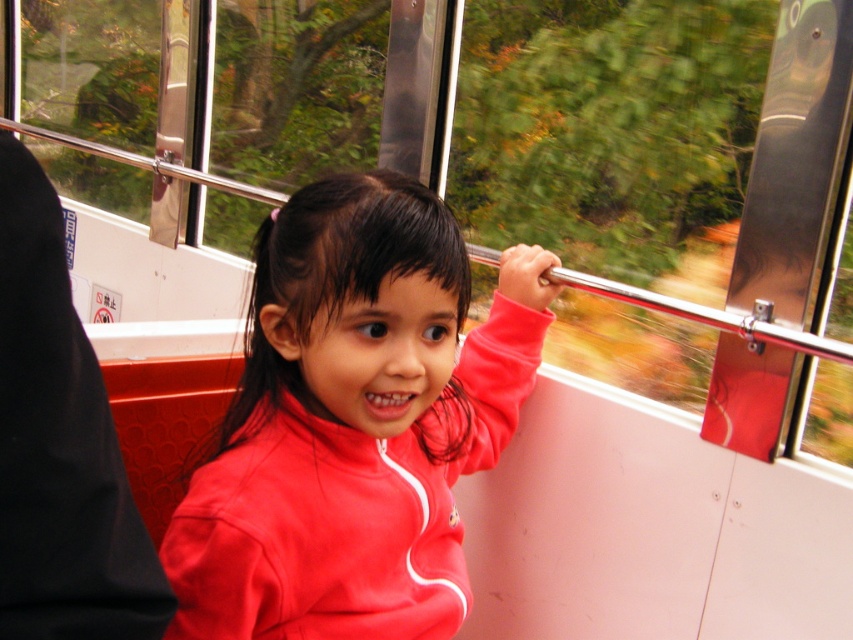
Question: Can you confirm if matte red jacket at center is positioned to the left of black fabric coach at left?

Choices:
 (A) no
 (B) yes

Answer: (A)

Question: Which point appears closest to the camera in this image?

Choices:
 (A) (395, 243)
 (B) (33, 600)

Answer: (B)

Question: Is matte red jacket at center wider than black fabric coach at left?

Choices:
 (A) yes
 (B) no

Answer: (A)

Question: Can you confirm if matte red jacket at center is positioned below black fabric coach at left?

Choices:
 (A) no
 (B) yes

Answer: (B)

Question: Which point appears closest to the camera in this image?

Choices:
 (A) (21, 401)
 (B) (527, 301)

Answer: (A)